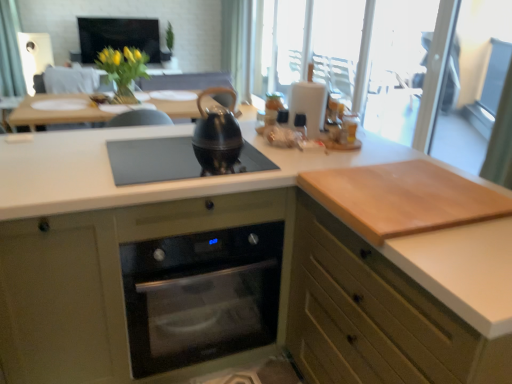
Question: Is the position of wooden cutting board at right, arranged as the 1th cabinetry when viewed from the right, more distant than that of light brown wood cutting board at right?

Choices:
 (A) no
 (B) yes

Answer: (A)

Question: Is wooden cutting board at right, placed as the second cabinetry when sorted from left to right, facing away from light brown wood cutting board at right?

Choices:
 (A) yes
 (B) no

Answer: (B)

Question: From a real-world perspective, is wooden cutting board at right, arranged as the 1th cabinetry when viewed from the right, below light brown wood cutting board at right?

Choices:
 (A) yes
 (B) no

Answer: (A)

Question: Is wooden cutting board at right, arranged as the 1th cabinetry when viewed from the right, aimed at light brown wood cutting board at right?

Choices:
 (A) yes
 (B) no

Answer: (B)

Question: Is there a large distance between wooden cutting board at right, placed as the second cabinetry when sorted from left to right, and light brown wood cutting board at right?

Choices:
 (A) yes
 (B) no

Answer: (B)

Question: From the image's perspective, is wooden cutting board at right, arranged as the 1th cabinetry when viewed from the right, beneath light brown wood cutting board at right?

Choices:
 (A) yes
 (B) no

Answer: (A)

Question: Is wooden cutting board at right, arranged as the 1th cabinetry when viewed from the right, facing towards matte black screen at upper center?

Choices:
 (A) no
 (B) yes

Answer: (A)

Question: From the image's perspective, is wooden cutting board at right, arranged as the 1th cabinetry when viewed from the right, over matte black screen at upper center?

Choices:
 (A) yes
 (B) no

Answer: (B)

Question: Considering the relative positions of wooden cutting board at right, placed as the second cabinetry when sorted from left to right, and matte black screen at upper center in the image provided, is wooden cutting board at right, placed as the second cabinetry when sorted from left to right, behind matte black screen at upper center?

Choices:
 (A) yes
 (B) no

Answer: (B)

Question: Are wooden cutting board at right, arranged as the 1th cabinetry when viewed from the right, and matte black screen at upper center located far from each other?

Choices:
 (A) no
 (B) yes

Answer: (B)

Question: Considering the relative sizes of wooden cutting board at right, placed as the second cabinetry when sorted from left to right, and matte black screen at upper center in the image provided, is wooden cutting board at right, placed as the second cabinetry when sorted from left to right, smaller than matte black screen at upper center?

Choices:
 (A) yes
 (B) no

Answer: (B)

Question: From a real-world perspective, is wooden cutting board at right, placed as the second cabinetry when sorted from left to right, positioned under matte black screen at upper center based on gravity?

Choices:
 (A) yes
 (B) no

Answer: (A)

Question: Is transparent glass screen door at upper right wider than matte black screen at upper center?

Choices:
 (A) yes
 (B) no

Answer: (B)